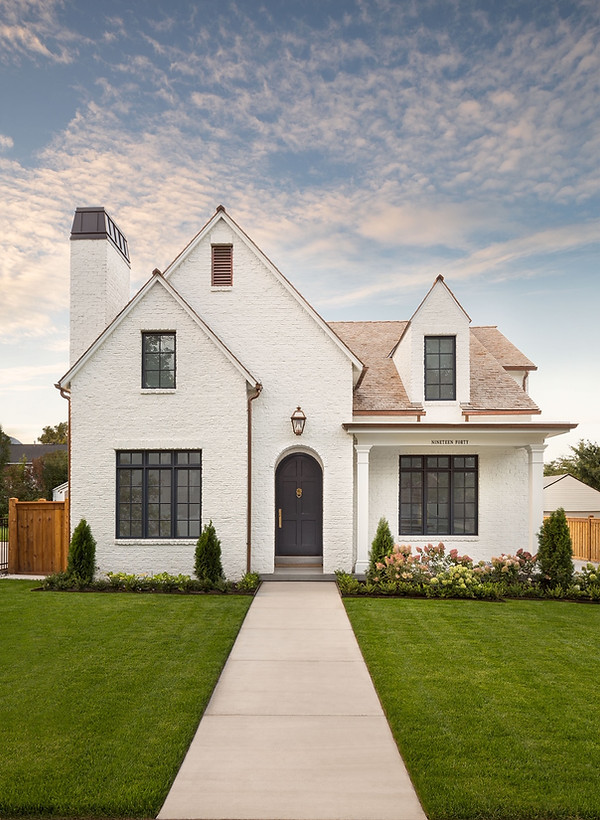
Where is `window`? window is located at coordinates (156, 497), (157, 358), (445, 374), (439, 499).